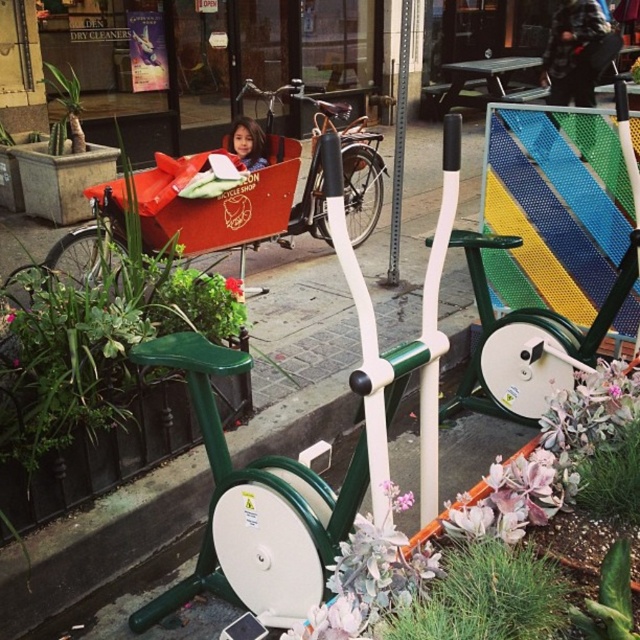
Is point (394, 257) farther from viewer compared to point (244, 144)?

Yes, it is behind point (244, 144).

Describe the element at coordinates (397, 141) in the screenshot. This screenshot has height=640, width=640. I see `metallic pole at center` at that location.

What are the coordinates of `metallic pole at center` in the screenshot? It's located at (397, 141).

Based on the photo, is metallic pole at center wider than green leafy plant at left?

No.

What do you see at coordinates (397, 141) in the screenshot?
I see `metallic pole at center` at bounding box center [397, 141].

Find the location of `metallic pole at center`. metallic pole at center is located at coordinates (397, 141).

Between green leafy plant at left and smooth skin face at center, which one appears on the right side from the viewer's perspective?

smooth skin face at center is more to the right.

Between green leafy plant at left and smooth skin face at center, which one has less height?

With less height is smooth skin face at center.

Which is in front, point (60, 97) or point (241, 147)?

Point (241, 147) is in front.

Find the location of a particular element. The image size is (640, 640). green leafy plant at left is located at coordinates (67, 102).